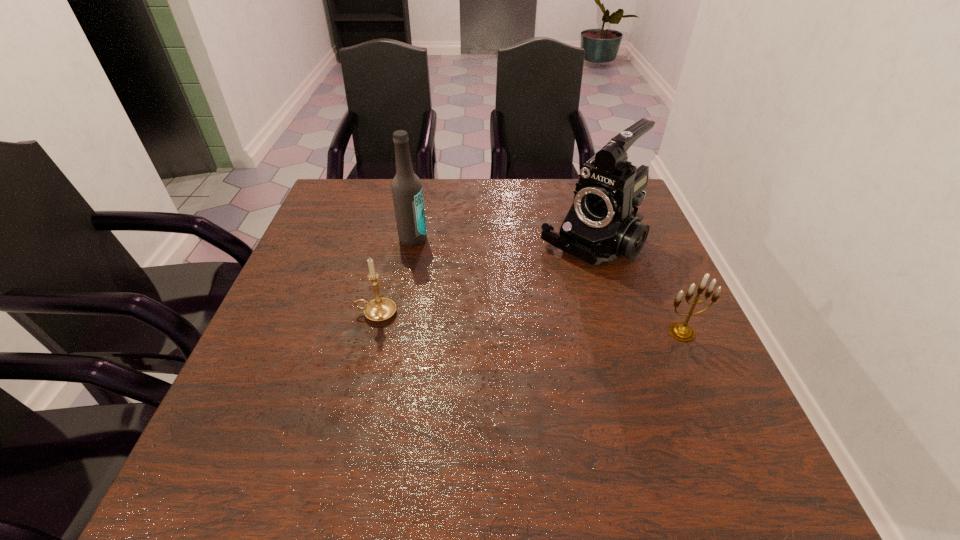
Identify the location of free spot on the desktop that is between the left candelabrum and the right candelabrum and is positioned on the lens mount of the camcorder. Image resolution: width=960 pixels, height=540 pixels. (502, 321).

Where is `free spot on the desktop that is between the left candelabrum and the right candelabrum and is positioned on the label of the beer bottle`? Image resolution: width=960 pixels, height=540 pixels. free spot on the desktop that is between the left candelabrum and the right candelabrum and is positioned on the label of the beer bottle is located at coordinates (503, 321).